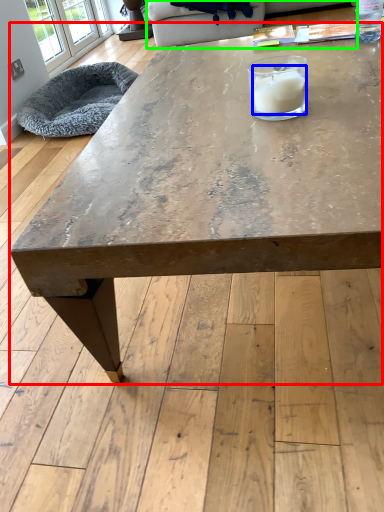
Question: Considering the real-world distances, which object is closest to coffee table (highlighted by a red box)? candle (highlighted by a blue box) or couch (highlighted by a green box).

Choices:
 (A) candle
 (B) couch

Answer: (A)